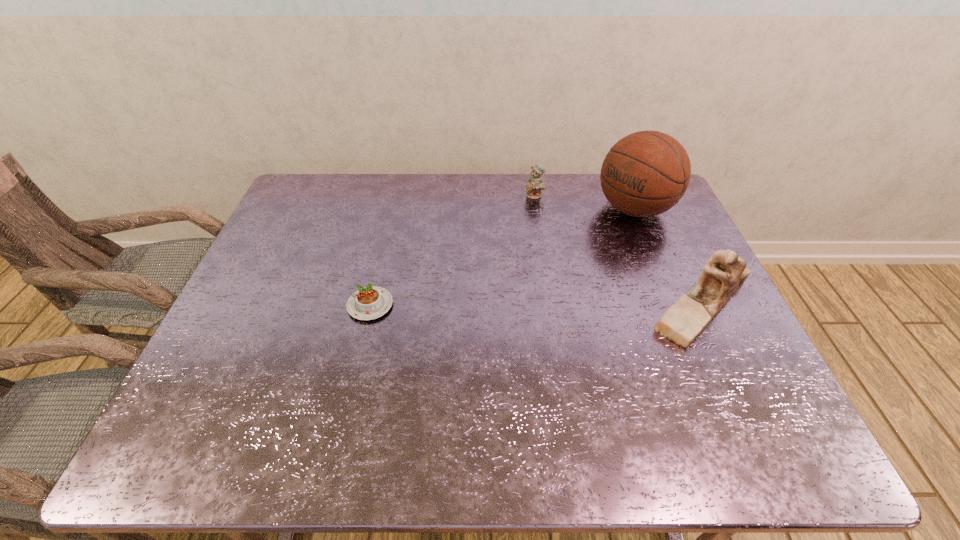
At what (x,y) coordinates should I click in order to perform the action: click on the shortest object. Please return your answer as a coordinate pair (x, y). Image resolution: width=960 pixels, height=540 pixels. Looking at the image, I should click on (371, 302).

The height and width of the screenshot is (540, 960). Find the location of `pudding`. pudding is located at coordinates pyautogui.click(x=371, y=302).

At what (x,y) coordinates should I click in order to perform the action: click on figurine. Please return your answer as a coordinate pair (x, y). This screenshot has width=960, height=540. Looking at the image, I should click on (725, 272).

The image size is (960, 540). In order to click on the tallest object in this screenshot , I will do `click(646, 173)`.

At what (x,y) coordinates should I click in order to perform the action: click on the third tallest object. Please return your answer as a coordinate pair (x, y). Looking at the image, I should click on (535, 183).

The width and height of the screenshot is (960, 540). I want to click on teddy bear, so click(x=535, y=183).

Image resolution: width=960 pixels, height=540 pixels. I want to click on free region located on the right of the pudding, so click(508, 305).

Identify the location of free space located 0.350m on the front-facing side of the figurine. (511, 305).

Find the location of a particular element. This screenshot has width=960, height=540. blank space located 0.230m on the front-facing side of the figurine is located at coordinates (557, 305).

You are a GUI agent. You are given a task and a screenshot of the screen. Output one action in this format:
    pyautogui.click(x=<x>, y=<y>)
    Task: Click on the vacant space situated on the front-facing side of the figurine
    The width and height of the screenshot is (960, 540).
    Given the screenshot: What is the action you would take?
    pyautogui.click(x=503, y=305)